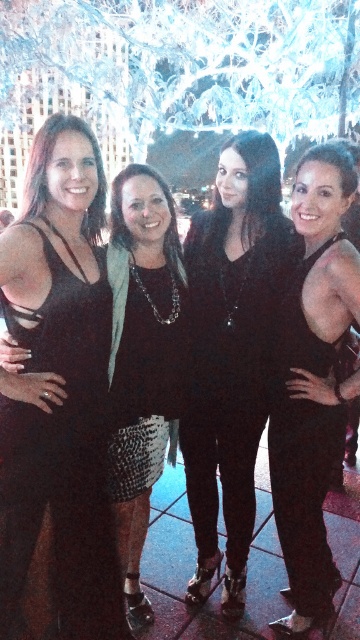
Question: Does black matte dress at center lie in front of black textured dress at left?

Choices:
 (A) no
 (B) yes

Answer: (B)

Question: Is black matte dress at center to the left of black textured dress at left from the viewer's perspective?

Choices:
 (A) yes
 (B) no

Answer: (B)

Question: Which object is the farthest from the black matte dress at center?

Choices:
 (A) black textured dress at left
 (B) black leather dress at center

Answer: (A)

Question: From the image, what is the correct spatial relationship of black matte dress at center in relation to black textured dress at left?

Choices:
 (A) below
 (B) above

Answer: (B)

Question: Among these objects, which one is nearest to the camera?

Choices:
 (A) black matte dress at center
 (B) black leather dress at center
 (C) black textured dress at left

Answer: (A)

Question: Which of the following is the closest to the observer?

Choices:
 (A) black leather dress at center
 (B) black matte dress at center

Answer: (B)